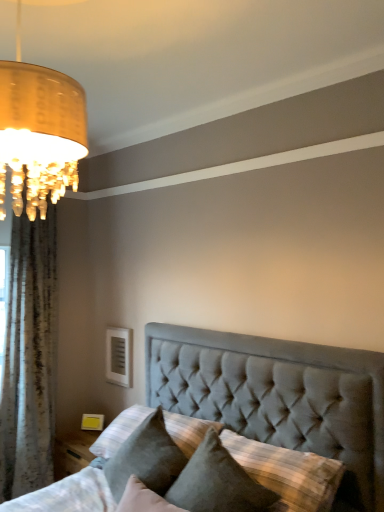
What do you see at coordinates (217, 482) in the screenshot? I see `suede pillow at center, marked as the second pillow in a left-to-right arrangement` at bounding box center [217, 482].

What do you see at coordinates (146, 458) in the screenshot? I see `velvet gray pillow at lower center, the 1th pillow when ordered from left to right` at bounding box center [146, 458].

Image resolution: width=384 pixels, height=512 pixels. In order to click on suede pillow at center, the 1th pillow in the right-to-left sequence in this screenshot , I will do `click(217, 482)`.

Is velvet gray pillow at lower center, the 1th pillow when ordered from left to right, facing away from suede pillow at center, marked as the second pillow in a left-to-right arrangement?

No, velvet gray pillow at lower center, the 1th pillow when ordered from left to right,'s orientation is not away from suede pillow at center, marked as the second pillow in a left-to-right arrangement.

From the image's perspective, is velvet gray pillow at lower center, the 1th pillow when ordered from left to right, above or below suede pillow at center, marked as the second pillow in a left-to-right arrangement?

Based on their image positions, velvet gray pillow at lower center, the 1th pillow when ordered from left to right, is located above suede pillow at center, marked as the second pillow in a left-to-right arrangement.

Which is more distant, (128, 471) or (192, 483)?

A: The point (128, 471) is behind.

From a real-world perspective, between velvet gray pillow at lower center, the 1th pillow when ordered from left to right, and suede pillow at center, the 1th pillow in the right-to-left sequence, who is vertically higher?

velvet gray pillow at lower center, the 1th pillow when ordered from left to right.

Is white textured curtain at left wider or thinner than velvet gray pillow at lower center, the second pillow viewed from the right?

In the image, white textured curtain at left appears to be more narrow than velvet gray pillow at lower center, the second pillow viewed from the right.

Considering the relative positions of white textured curtain at left and velvet gray pillow at lower center, the 1th pillow when ordered from left to right, in the image provided, is white textured curtain at left behind velvet gray pillow at lower center, the 1th pillow when ordered from left to right,?

Yes, white textured curtain at left is further from the camera.

Based on their sizes in the image, would you say white textured curtain at left is bigger or smaller than velvet gray pillow at lower center, the second pillow viewed from the right?

In the image, white textured curtain at left appears to be larger than velvet gray pillow at lower center, the second pillow viewed from the right.

How different are the orientations of white textured curtain at left and velvet gray pillow at lower center, the 1th pillow when ordered from left to right, in degrees?

100 degrees.

Is point (20, 419) in front of point (196, 494)?

That is False.

From the picture: Which is more to the right, white textured curtain at left or suede pillow at center, marked as the second pillow in a left-to-right arrangement?

suede pillow at center, marked as the second pillow in a left-to-right arrangement, is more to the right.

Which object is closer to the camera taking this photo, white textured curtain at left or suede pillow at center, the 1th pillow in the right-to-left sequence?

suede pillow at center, the 1th pillow in the right-to-left sequence.

Is white textured curtain at left completely or partially outside of suede pillow at center, the 1th pillow in the right-to-left sequence?

white textured curtain at left lies outside suede pillow at center, the 1th pillow in the right-to-left sequence,'s area.

Considering the positions of objects suede pillow at center, the 1th pillow in the right-to-left sequence, and white textured curtain at left in the image provided, who is in front, suede pillow at center, the 1th pillow in the right-to-left sequence, or white textured curtain at left?

suede pillow at center, the 1th pillow in the right-to-left sequence, is more forward.

Is suede pillow at center, the 1th pillow in the right-to-left sequence, at the right side of white textured curtain at left?

Indeed, suede pillow at center, the 1th pillow in the right-to-left sequence, is positioned on the right side of white textured curtain at left.

Who is shorter, suede pillow at center, marked as the second pillow in a left-to-right arrangement, or white textured curtain at left?

suede pillow at center, marked as the second pillow in a left-to-right arrangement.

Looking at this image, from the image's perspective, is suede pillow at center, the 1th pillow in the right-to-left sequence, on top of white textured curtain at left?

No.

Where is `curtain lying above the velvet gray pillow at lower center, the second pillow viewed from the right (from the image's perspective)`? This screenshot has width=384, height=512. curtain lying above the velvet gray pillow at lower center, the second pillow viewed from the right (from the image's perspective) is located at coordinates pos(29,358).

Can you see velvet gray pillow at lower center, the 1th pillow when ordered from left to right, touching white textured curtain at left?

No.

Who is taller, velvet gray pillow at lower center, the 1th pillow when ordered from left to right, or white textured curtain at left?

Standing taller between the two is white textured curtain at left.

In the scene shown: From the image's perspective, is velvet gray pillow at lower center, the 1th pillow when ordered from left to right, above or below white textured curtain at left?

Based on their image positions, velvet gray pillow at lower center, the 1th pillow when ordered from left to right, is located beneath white textured curtain at left.

From the image's perspective, is suede pillow at center, marked as the second pillow in a left-to-right arrangement, located above velvet gray pillow at lower center, the 1th pillow when ordered from left to right?

No.

Can you see suede pillow at center, the 1th pillow in the right-to-left sequence, touching velvet gray pillow at lower center, the 1th pillow when ordered from left to right?

No, suede pillow at center, the 1th pillow in the right-to-left sequence, is not making contact with velvet gray pillow at lower center, the 1th pillow when ordered from left to right.

Where is `pillow above the suede pillow at center, marked as the second pillow in a left-to-right arrangement (from a real-world perspective)`? pillow above the suede pillow at center, marked as the second pillow in a left-to-right arrangement (from a real-world perspective) is located at coordinates (146, 458).

Visually, is suede pillow at center, marked as the second pillow in a left-to-right arrangement, positioned to the left or to the right of velvet gray pillow at lower center, the 1th pillow when ordered from left to right?

From the image, it's evident that suede pillow at center, marked as the second pillow in a left-to-right arrangement, is to the right of velvet gray pillow at lower center, the 1th pillow when ordered from left to right.

The width and height of the screenshot is (384, 512). I want to click on pillow located in front of the velvet gray pillow at lower center, the second pillow viewed from the right, so click(217, 482).

You are a GUI agent. You are given a task and a screenshot of the screen. Output one action in this format:
    pyautogui.click(x=<x>, y=<y>)
    Task: Click on the curtain above the velvet gray pillow at lower center, the 1th pillow when ordered from left to right (from a real-world perspective)
    
    Given the screenshot: What is the action you would take?
    pyautogui.click(x=29, y=358)

Which object lies nearer to the anchor point white textured curtain at left, velvet gray pillow at lower center, the 1th pillow when ordered from left to right, or suede pillow at center, marked as the second pillow in a left-to-right arrangement?

velvet gray pillow at lower center, the 1th pillow when ordered from left to right, is positioned closer to the anchor white textured curtain at left.

Looking at the image, which one is located further to velvet gray pillow at lower center, the second pillow viewed from the right, white textured curtain at left or suede pillow at center, marked as the second pillow in a left-to-right arrangement?

white textured curtain at left lies further to velvet gray pillow at lower center, the second pillow viewed from the right, than the other object.

Based on their spatial positions, is velvet gray pillow at lower center, the 1th pillow when ordered from left to right, or white textured curtain at left closer to suede pillow at center, marked as the second pillow in a left-to-right arrangement?

Based on the image, velvet gray pillow at lower center, the 1th pillow when ordered from left to right, appears to be nearer to suede pillow at center, marked as the second pillow in a left-to-right arrangement.

In the scene shown: Which object lies nearer to the anchor point velvet gray pillow at lower center, the 1th pillow when ordered from left to right, suede pillow at center, marked as the second pillow in a left-to-right arrangement, or white textured curtain at left?

suede pillow at center, marked as the second pillow in a left-to-right arrangement, is closer to velvet gray pillow at lower center, the 1th pillow when ordered from left to right.

Based on their spatial positions, is suede pillow at center, marked as the second pillow in a left-to-right arrangement, or velvet gray pillow at lower center, the 1th pillow when ordered from left to right, further from white textured curtain at left?

suede pillow at center, marked as the second pillow in a left-to-right arrangement, lies further to white textured curtain at left than the other object.

Based on the photo, based on their spatial positions, is white textured curtain at left or velvet gray pillow at lower center, the second pillow viewed from the right, closer to suede pillow at center, the 1th pillow in the right-to-left sequence?

Based on the image, velvet gray pillow at lower center, the second pillow viewed from the right, appears to be nearer to suede pillow at center, the 1th pillow in the right-to-left sequence.

At what (x,y) coordinates should I click in order to perform the action: click on pillow between suede pillow at center, marked as the second pillow in a left-to-right arrangement, and white textured curtain at left from front to back. Please return your answer as a coordinate pair (x, y). Looking at the image, I should click on (146, 458).